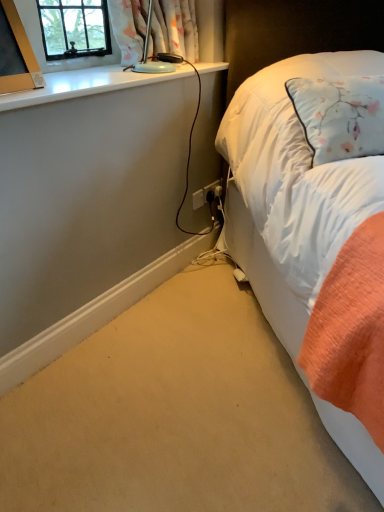
What do you see at coordinates (211, 187) in the screenshot?
I see `black plastic power plugs and sockets at lower right, acting as the 1th power plugs and sockets starting from the right` at bounding box center [211, 187].

What are the coordinates of `matte gold picture frame at upper left` in the screenshot? It's located at (21, 55).

Measure the distance between white plastic power plugs and sockets at lower center, arranged as the first power plugs and sockets when viewed from the left, and camera.

The distance of white plastic power plugs and sockets at lower center, arranged as the first power plugs and sockets when viewed from the left, from camera is 2.12 meters.

This screenshot has width=384, height=512. What are the coordinates of `floral fabric curtain at upper left` in the screenshot? It's located at (129, 27).

Identify the location of black plastic power plugs and sockets at lower right, acting as the 1th power plugs and sockets starting from the right. (211, 187).

Could you tell me if matte gold picture frame at upper left is turned towards black plastic power plugs and sockets at lower right, acting as the 1th power plugs and sockets starting from the right?

No, matte gold picture frame at upper left is not facing towards black plastic power plugs and sockets at lower right, acting as the 1th power plugs and sockets starting from the right.

Could you measure the distance between matte gold picture frame at upper left and black plastic power plugs and sockets at lower right, the 2th power plugs and sockets when ordered from left to right?

3.51 feet.

How many degrees apart are the facing directions of matte gold picture frame at upper left and black plastic power plugs and sockets at lower right, the 2th power plugs and sockets when ordered from left to right?

The angle between the facing direction of matte gold picture frame at upper left and the facing direction of black plastic power plugs and sockets at lower right, the 2th power plugs and sockets when ordered from left to right, is 3.64 degrees.

Would you say matte gold picture frame at upper left is to the left or to the right of black plastic power plugs and sockets at lower right, acting as the 1th power plugs and sockets starting from the right, in the picture?

matte gold picture frame at upper left is to the left of black plastic power plugs and sockets at lower right, acting as the 1th power plugs and sockets starting from the right.

Which of these two, white soft bed at right or matte gold picture frame at upper left, is thinner?

matte gold picture frame at upper left.

How distant is white soft bed at right from matte gold picture frame at upper left?

white soft bed at right and matte gold picture frame at upper left are 3.40 feet apart.

Where is `picture frame behind the white soft bed at right`? The image size is (384, 512). picture frame behind the white soft bed at right is located at coordinates (21, 55).

Find the location of a particular element. The height and width of the screenshot is (512, 384). power plugs and sockets that is the 2nd object located behind the floral fabric curtain at upper left is located at coordinates (211, 187).

In the scene shown: Which object is thinner, floral fabric curtain at upper left or black plastic power plugs and sockets at lower right, the 2th power plugs and sockets when ordered from left to right?

black plastic power plugs and sockets at lower right, the 2th power plugs and sockets when ordered from left to right, is thinner.

From a real-world perspective, which object stands above the other?

floral fabric curtain at upper left is physically above.

Is white glossy window sill at upper left not close to floral fabric curtain at upper left?

Actually, white glossy window sill at upper left and floral fabric curtain at upper left are a little close together.

Can you confirm if white glossy window sill at upper left is shorter than floral fabric curtain at upper left?

Indeed, white glossy window sill at upper left has a lesser height compared to floral fabric curtain at upper left.

How many degrees apart are the facing directions of white glossy window sill at upper left and floral fabric curtain at upper left?

white glossy window sill at upper left and floral fabric curtain at upper left are facing 2.18 degrees away from each other.

From a real-world perspective, is white glossy window sill at upper left physically above floral fabric curtain at upper left?

Actually, white glossy window sill at upper left is physically below floral fabric curtain at upper left in the real world.

From the image's perspective, which one is positioned higher, matte gold picture frame at upper left or white glossy window sill at upper left?

white glossy window sill at upper left appears higher in the image.

Which object is thinner, matte gold picture frame at upper left or white glossy window sill at upper left?

matte gold picture frame at upper left is thinner.

Which of these two, matte gold picture frame at upper left or white glossy window sill at upper left, stands taller?

Standing taller between the two is matte gold picture frame at upper left.

From a real-world perspective, is white plastic power plugs and sockets at lower center, arranged as the first power plugs and sockets when viewed from the left, located beneath matte gold picture frame at upper left?

Yes, from a real-world perspective, white plastic power plugs and sockets at lower center, arranged as the first power plugs and sockets when viewed from the left, is under matte gold picture frame at upper left.

Considering the positions of points (197, 196) and (13, 79), is point (197, 196) closer to camera compared to point (13, 79)?

No, it is behind (13, 79).

You are a GUI agent. You are given a task and a screenshot of the screen. Output one action in this format:
    pyautogui.click(x=<x>, y=<y>)
    Task: Click on the 1st power plugs and sockets counting from the right side of the matte gold picture frame at upper left
    This screenshot has width=384, height=512.
    Given the screenshot: What is the action you would take?
    pyautogui.click(x=198, y=199)

Does white plastic power plugs and sockets at lower center, which appears as the 2th power plugs and sockets when viewed from the right, have a larger size compared to matte gold picture frame at upper left?

Actually, white plastic power plugs and sockets at lower center, which appears as the 2th power plugs and sockets when viewed from the right, might be smaller than matte gold picture frame at upper left.

Does black plastic power plugs and sockets at lower right, the 2th power plugs and sockets when ordered from left to right, appear on the right side of white plastic power plugs and sockets at lower center, which appears as the 2th power plugs and sockets when viewed from the right?

Yes.

Does point (205, 190) come closer to viewer compared to point (198, 190)?

No, it is not.

Could you tell me if black plastic power plugs and sockets at lower right, the 2th power plugs and sockets when ordered from left to right, is turned towards white plastic power plugs and sockets at lower center, which appears as the 2th power plugs and sockets when viewed from the right?

No, black plastic power plugs and sockets at lower right, the 2th power plugs and sockets when ordered from left to right, is not oriented towards white plastic power plugs and sockets at lower center, which appears as the 2th power plugs and sockets when viewed from the right.

Where is `power plugs and sockets that is the 1st one when counting downward from the matte gold picture frame at upper left (from the image's perspective)`? This screenshot has width=384, height=512. power plugs and sockets that is the 1st one when counting downward from the matte gold picture frame at upper left (from the image's perspective) is located at coordinates (211, 187).

The image size is (384, 512). In order to click on picture frame above the white soft bed at right (from a real-world perspective) in this screenshot , I will do `click(21, 55)`.

Which object lies further to the anchor point white plastic power plugs and sockets at lower center, arranged as the first power plugs and sockets when viewed from the left, matte gold picture frame at upper left or floral fabric curtain at upper left?

matte gold picture frame at upper left.

From the image, which object appears to be farther from white plastic power plugs and sockets at lower center, arranged as the first power plugs and sockets when viewed from the left, white glossy window sill at upper left or black plastic power plugs and sockets at lower right, acting as the 1th power plugs and sockets starting from the right?

white glossy window sill at upper left is positioned further to the anchor white plastic power plugs and sockets at lower center, arranged as the first power plugs and sockets when viewed from the left.

From the picture: Based on their spatial positions, is white glossy window sill at upper left or floral fabric curtain at upper left closer to black plastic power plugs and sockets at lower right, acting as the 1th power plugs and sockets starting from the right?

The object closer to black plastic power plugs and sockets at lower right, acting as the 1th power plugs and sockets starting from the right, is floral fabric curtain at upper left.

Which object lies further to the anchor point white glossy window sill at upper left, black plastic power plugs and sockets at lower right, the 2th power plugs and sockets when ordered from left to right, or matte gold picture frame at upper left?

Among the two, black plastic power plugs and sockets at lower right, the 2th power plugs and sockets when ordered from left to right, is located further to white glossy window sill at upper left.

Looking at the image, which one is located closer to matte gold picture frame at upper left, white glossy window sill at upper left or floral fabric curtain at upper left?

Based on the image, white glossy window sill at upper left appears to be nearer to matte gold picture frame at upper left.

From the image, which object appears to be farther from white plastic power plugs and sockets at lower center, arranged as the first power plugs and sockets when viewed from the left, white soft bed at right or floral fabric curtain at upper left?

The object further to white plastic power plugs and sockets at lower center, arranged as the first power plugs and sockets when viewed from the left, is white soft bed at right.

Estimate the real-world distances between objects in this image. Which object is further from floral fabric curtain at upper left, white soft bed at right or black plastic power plugs and sockets at lower right, the 2th power plugs and sockets when ordered from left to right?

black plastic power plugs and sockets at lower right, the 2th power plugs and sockets when ordered from left to right, is positioned further to the anchor floral fabric curtain at upper left.

Estimate the real-world distances between objects in this image. Which object is further from matte gold picture frame at upper left, white glossy window sill at upper left or white soft bed at right?

white soft bed at right is further to matte gold picture frame at upper left.

Find the location of `picture frame positioned between white soft bed at right and black plastic power plugs and sockets at lower right, the 2th power plugs and sockets when ordered from left to right, from near to far`. picture frame positioned between white soft bed at right and black plastic power plugs and sockets at lower right, the 2th power plugs and sockets when ordered from left to right, from near to far is located at coordinates (21, 55).

I want to click on window sill between matte gold picture frame at upper left and floral fabric curtain at upper left from left to right, so click(86, 85).

Locate an element on the screen. The height and width of the screenshot is (512, 384). power plugs and sockets positioned between matte gold picture frame at upper left and black plastic power plugs and sockets at lower right, the 2th power plugs and sockets when ordered from left to right, from near to far is located at coordinates (198, 199).

You are a GUI agent. You are given a task and a screenshot of the screen. Output one action in this format:
    pyautogui.click(x=<x>, y=<y>)
    Task: Click on the curtain between matte gold picture frame at upper left and white plastic power plugs and sockets at lower center, arranged as the first power plugs and sockets when viewed from the left, along the z-axis
    This screenshot has height=512, width=384.
    Given the screenshot: What is the action you would take?
    pyautogui.click(x=129, y=27)